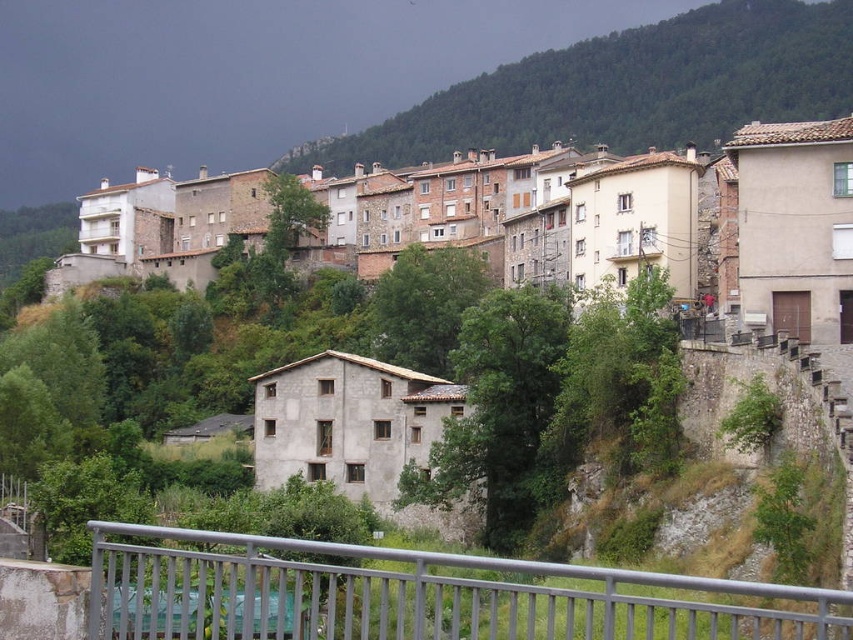
Which is behind, point (291, 621) or point (737, 70)?

Point (737, 70)

How far apart are silver metallic railing at lower center and green textured hillside at upper center?

The distance of silver metallic railing at lower center from green textured hillside at upper center is 228.38 meters.

Between point (315, 552) and point (396, 115), which one is positioned in front?

Positioned in front is point (315, 552).

You are a GUI agent. You are given a task and a screenshot of the screen. Output one action in this format:
    pyautogui.click(x=<x>, y=<y>)
    Task: Click on the silver metallic railing at lower center
    
    Given the screenshot: What is the action you would take?
    pyautogui.click(x=416, y=595)

Who is more distant from viewer, (564, 234) or (271, 572)?

The point (564, 234) is behind.

Does stone houses at upper center appear on the left side of silver metallic railing at lower center?

Correct, you'll find stone houses at upper center to the left of silver metallic railing at lower center.

Between point (424, 243) and point (267, 538), which one is positioned in front?

Point (267, 538) is in front.

At what (x,y) coordinates should I click in order to perform the action: click on stone houses at upper center. Please return your answer as a coordinate pair (x, y). This screenshot has height=640, width=853. Looking at the image, I should click on (538, 216).

Does stone houses at upper center appear over green textured hillside at upper center?

Actually, stone houses at upper center is below green textured hillside at upper center.

Is point (694, 280) closer to viewer compared to point (842, 10)?

Yes, point (694, 280) is in front of point (842, 10).

Find the location of `stone houses at upper center`. stone houses at upper center is located at coordinates (538, 216).